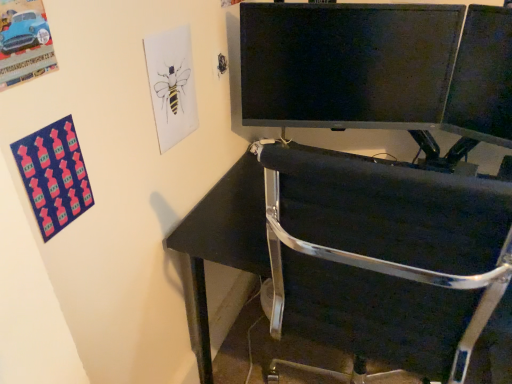
Question: Can you confirm if black metal chair at lower right is bigger than matte black monitor at upper right?

Choices:
 (A) yes
 (B) no

Answer: (A)

Question: Does black metal chair at lower right have a greater width compared to matte black monitor at upper right?

Choices:
 (A) no
 (B) yes

Answer: (B)

Question: Is black metal chair at lower right oriented towards matte black monitor at upper right?

Choices:
 (A) yes
 (B) no

Answer: (B)

Question: Is black metal chair at lower right with matte black monitor at upper right?

Choices:
 (A) yes
 (B) no

Answer: (B)

Question: Is black metal chair at lower right located outside matte black monitor at upper right?

Choices:
 (A) yes
 (B) no

Answer: (A)

Question: Can you confirm if black metal chair at lower right is taller than matte black monitor at upper right?

Choices:
 (A) yes
 (B) no

Answer: (A)

Question: Is matte black monitor at upper right oriented away from black metal chair at lower right?

Choices:
 (A) no
 (B) yes

Answer: (A)

Question: Considering the relative sizes of matte black monitor at upper right and black metal chair at lower right in the image provided, is matte black monitor at upper right smaller than black metal chair at lower right?

Choices:
 (A) no
 (B) yes

Answer: (B)

Question: Considering the relative sizes of matte black monitor at upper right and black metal chair at lower right in the image provided, is matte black monitor at upper right thinner than black metal chair at lower right?

Choices:
 (A) yes
 (B) no

Answer: (A)

Question: Can you confirm if matte black monitor at upper right is positioned to the right of black metal chair at lower right?

Choices:
 (A) yes
 (B) no

Answer: (A)

Question: From a real-world perspective, does matte black monitor at upper right stand above black metal chair at lower right?

Choices:
 (A) no
 (B) yes

Answer: (B)

Question: Does matte black monitor at upper right have a larger size compared to black metal chair at lower right?

Choices:
 (A) yes
 (B) no

Answer: (B)

Question: Is black metal chair at lower right positioned behind black glossy monitor at upper center?

Choices:
 (A) yes
 (B) no

Answer: (B)